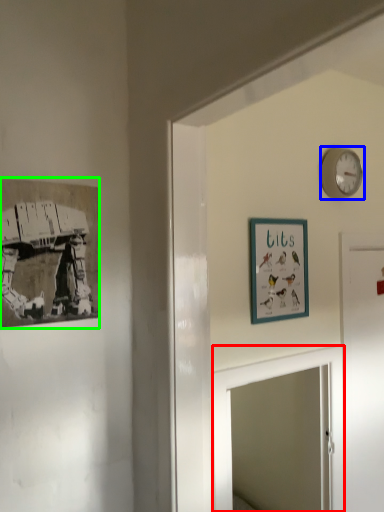
Question: Based on their relative distances, which object is nearer to mirror (highlighted by a red box)? Choose from wall clock (highlighted by a blue box) and picture frame (highlighted by a green box).

Choices:
 (A) wall clock
 (B) picture frame

Answer: (B)